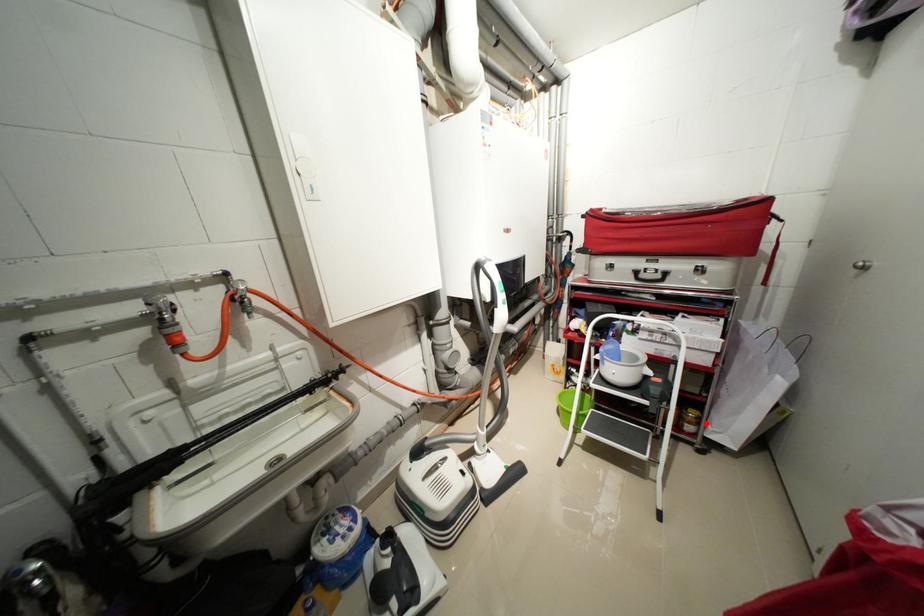
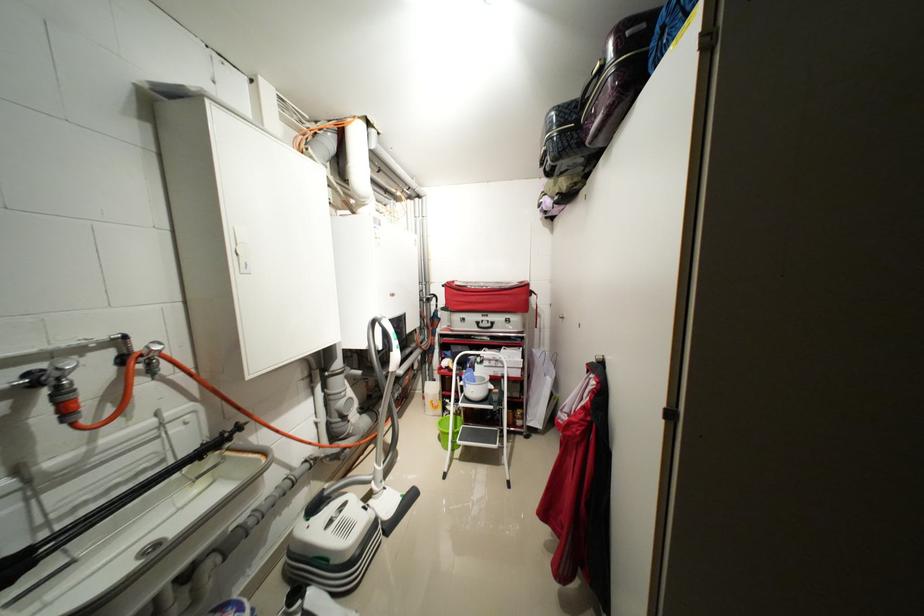
Locate, in the second image, the point that corresponds to the highlighted location in the first image.

(530, 418)